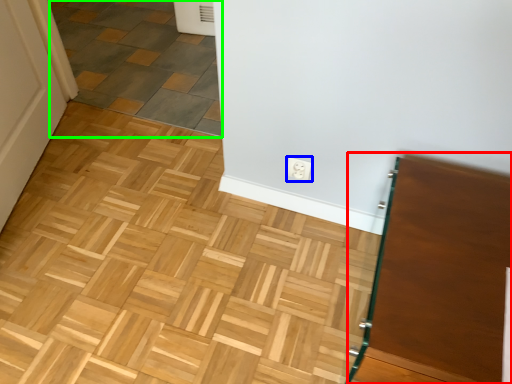
Question: Which object is the farthest from vanity (highlighted by a red box)? Choose among these: electric outlet (highlighted by a blue box) or tile (highlighted by a green box).

Choices:
 (A) electric outlet
 (B) tile

Answer: (B)